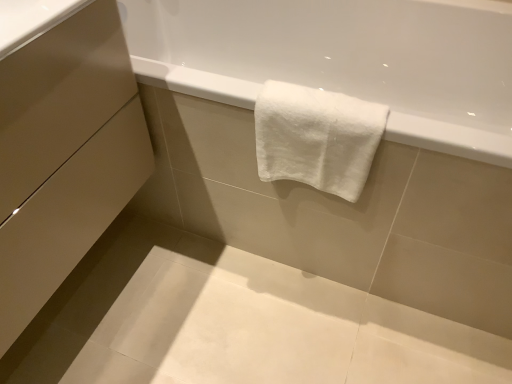
Question: In the image, is matte beige drawer at lower left, marked as the 2th drawer in a top-to-bottom arrangement, on the left side or the right side of matte beige drawer at lower left, which is the 1th drawer from top to bottom?

Choices:
 (A) left
 (B) right

Answer: (A)

Question: Relative to matte beige drawer at lower left, which is the 1th drawer from top to bottom, is matte beige drawer at lower left, marked as the 2th drawer in a top-to-bottom arrangement, in front or behind?

Choices:
 (A) behind
 (B) front

Answer: (B)

Question: Which is nearer to the matte beige drawer at lower left, marked as the 2th drawer in a top-to-bottom arrangement?

Choices:
 (A) white cotton towel at upper center
 (B) matte beige drawer at lower left, which is the 1th drawer from top to bottom

Answer: (B)

Question: Which of these objects is positioned closest to the white cotton towel at upper center?

Choices:
 (A) matte beige drawer at lower left, marked as the 1th drawer in a bottom-to-top arrangement
 (B) matte beige drawer at lower left, the second drawer positioned from the bottom

Answer: (B)